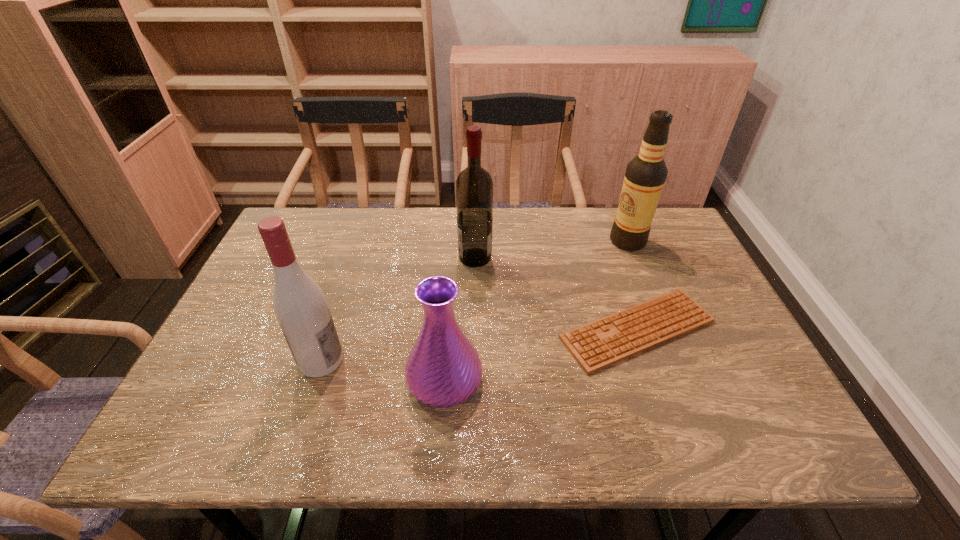
What are the coordinates of `the rightmost alcohol` in the screenshot? It's located at (645, 176).

You are a GUI agent. You are given a task and a screenshot of the screen. Output one action in this format:
    pyautogui.click(x=<x>, y=<y>)
    Task: Click on the second alcohol from left to right
    
    Given the screenshot: What is the action you would take?
    point(474,186)

Find the location of a particular element. This screenshot has width=960, height=540. the nearest alcohol is located at coordinates (300, 306).

Identify the location of the leftmost object. This screenshot has width=960, height=540. (300, 306).

Identify the location of the second shortest object. The image size is (960, 540). (443, 369).

Find the location of a particular element. This screenshot has height=540, width=960. computer keyboard is located at coordinates (596, 345).

Locate an element on the screen. free space located on the label of the rightmost alcohol is located at coordinates (584, 241).

Find the location of a particular element. The height and width of the screenshot is (540, 960). free space located on the label of the rightmost alcohol is located at coordinates (577, 241).

Identify the location of vacant space located 0.050m on the label of the rightmost alcohol. (593, 241).

Locate an element on the screen. Image resolution: width=960 pixels, height=540 pixels. free space located 0.170m on the front and back of the second alcohol from left to right is located at coordinates (550, 258).